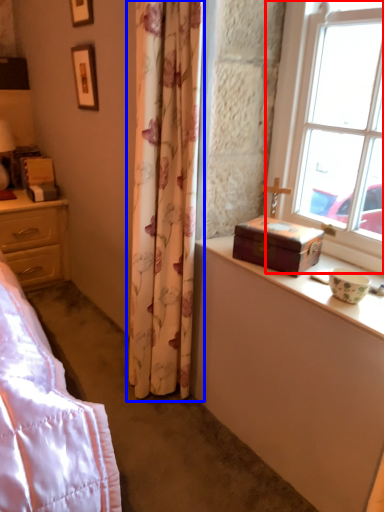
Question: Among these objects, which one is nearest to the camera, window (highlighted by a red box) or curtain (highlighted by a blue box)?

Choices:
 (A) window
 (B) curtain

Answer: (A)